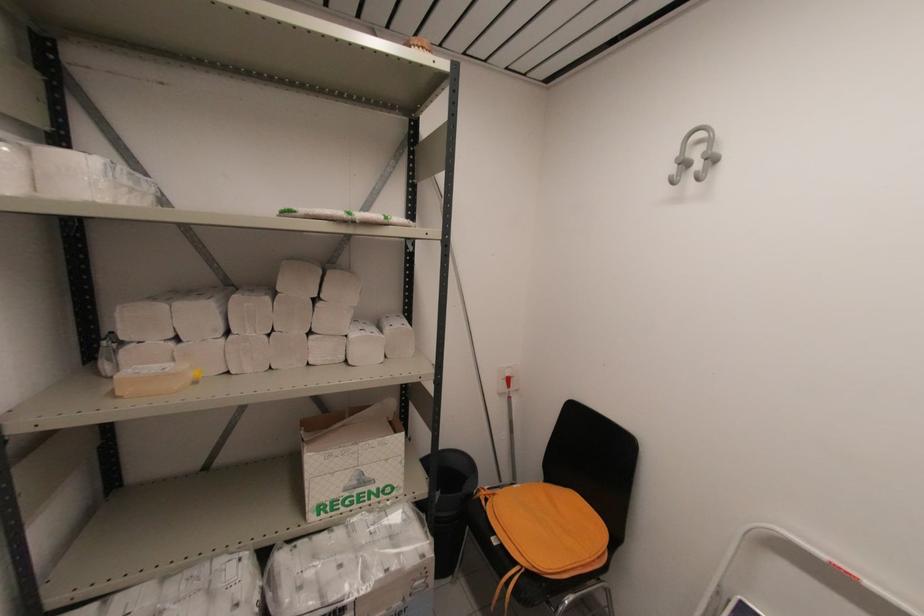
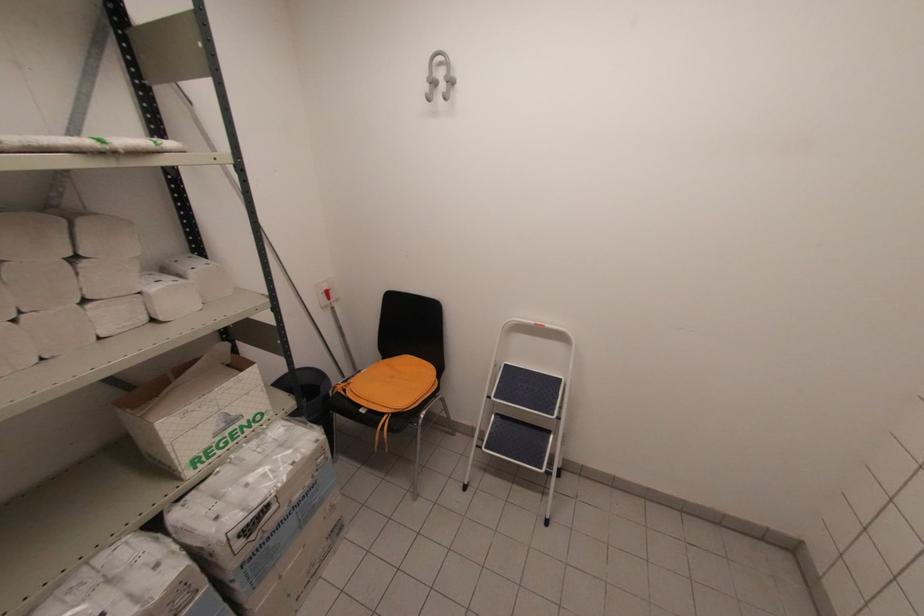
The point at [350,217] is marked in the first image. Where is the corresponding point in the second image?

(107, 148)